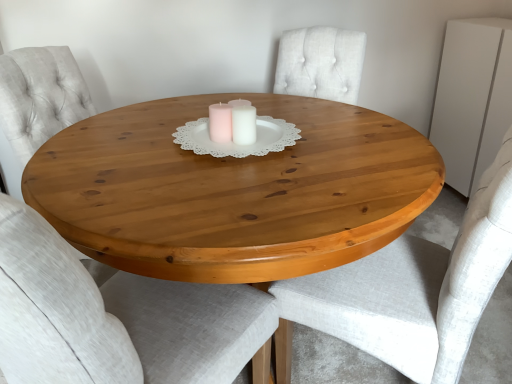
Question: Considering the positions of white paper doily at center and light gray fabric chair at right, which is counted as the second chair, starting from the left, in the image, is white paper doily at center wider or thinner than light gray fabric chair at right, which is counted as the second chair, starting from the left,?

Choices:
 (A) thin
 (B) wide

Answer: (A)

Question: From a real-world perspective, is white paper doily at center above or below light gray fabric chair at right, arranged as the 1th chair when viewed from the right?

Choices:
 (A) above
 (B) below

Answer: (A)

Question: Estimate the real-world distances between objects in this image. Which object is farther from the white paper doily at center?

Choices:
 (A) white matte candle at center
 (B) natural wood table at center
 (C) light gray fabric chair at right, which is counted as the second chair, starting from the left
 (D) light gray fabric chair at center, arranged as the second chair when viewed from the right
 (E) white matte dresser at upper right

Answer: (E)

Question: Which object is the closest to the white paper doily at center?

Choices:
 (A) white matte candle at center
 (B) white matte dresser at upper right
 (C) natural wood table at center
 (D) light gray fabric chair at center, marked as the first chair in a left-to-right arrangement
 (E) light gray fabric chair at right, which is counted as the second chair, starting from the left

Answer: (A)